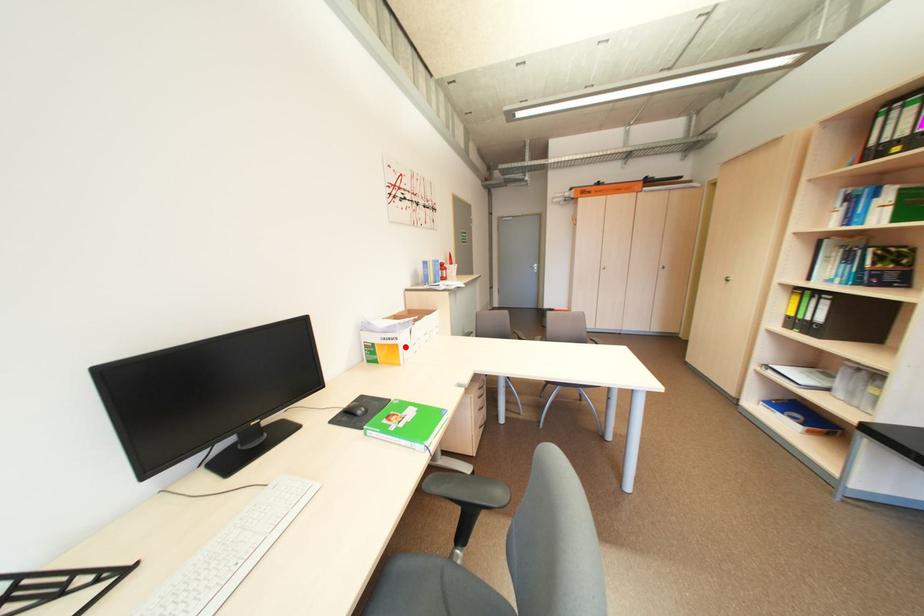
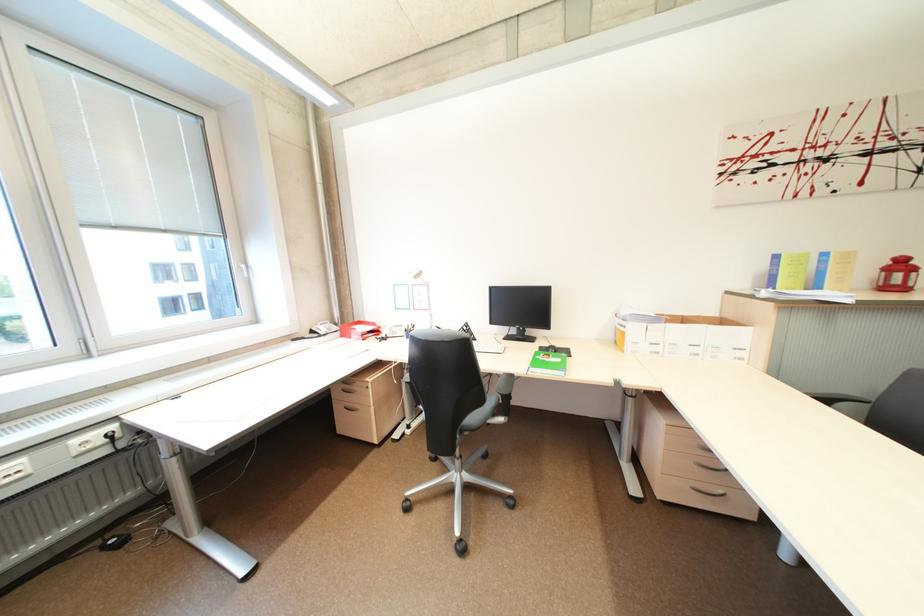
Question: I am providing you with two images of the same scene from different viewpoints. A red point is shown in image1. For the corresponding object point in image2, is it positioned nearer or farther from the camera?

Choices:
 (A) Nearer
 (B) Farther

Answer: (A)